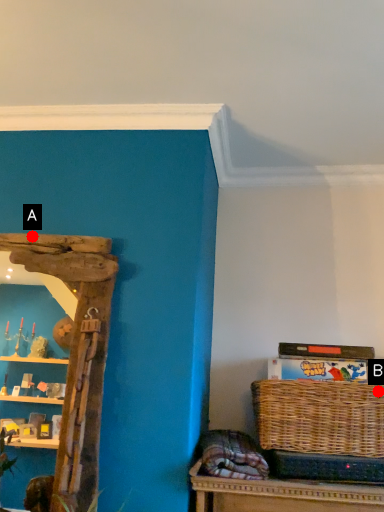
Question: Two points are circled on the image, labeled by A and B beside each circle. Which of the following is the closest to the observer?

Choices:
 (A) A is closer
 (B) B is closer

Answer: (B)